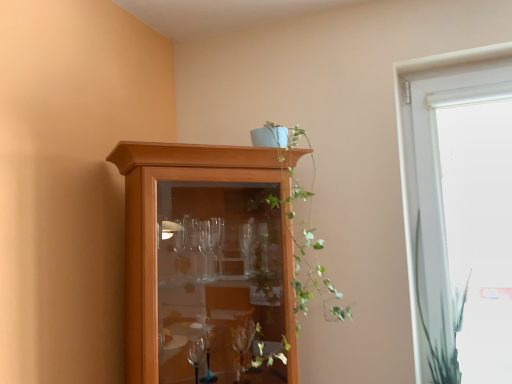
Question: Looking at the image, does wooden cabinet at upper center seem bigger or smaller compared to green leafy plant at upper center?

Choices:
 (A) small
 (B) big

Answer: (B)

Question: Which is correct: wooden cabinet at upper center is inside green leafy plant at upper center, or outside of it?

Choices:
 (A) inside
 (B) outside

Answer: (B)

Question: Which object is positioned farthest from the white glass window at right?

Choices:
 (A) green leafy plant at right
 (B) wooden cabinet at upper center
 (C) green leafy plant at upper center

Answer: (B)

Question: Which of these objects is positioned closest to the green leafy plant at right?

Choices:
 (A) green leafy plant at upper center
 (B) wooden cabinet at upper center
 (C) white glass window at right

Answer: (C)